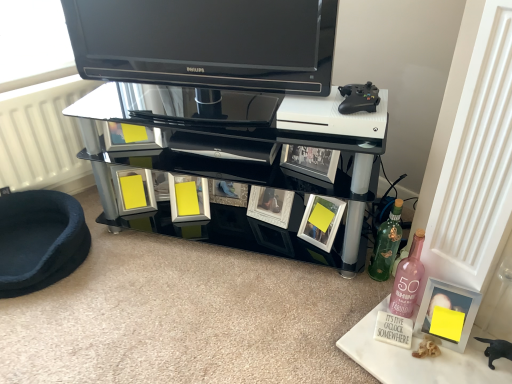
Find the location of `free space in front of green glass bottle at lower right, arranged as the first bottle when viewed from the back`. free space in front of green glass bottle at lower right, arranged as the first bottle when viewed from the back is located at coordinates (372, 301).